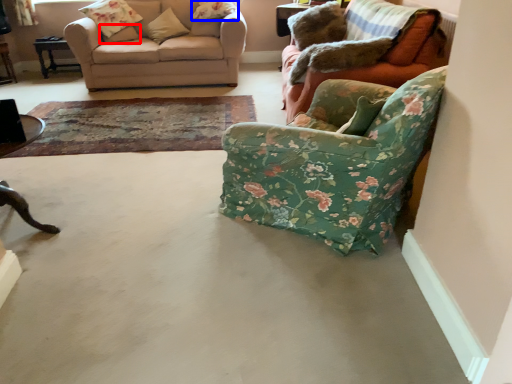
Question: Which point is further to the camera, pillow (highlighted by a red box) or pillow (highlighted by a blue box)?

Choices:
 (A) pillow
 (B) pillow

Answer: (A)